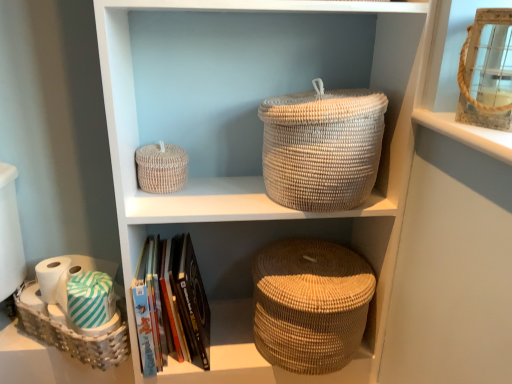
Question: Considering the positions of green striped fabric at lower left, which appears as the 1th toilet paper when viewed from the right, and natural woven basket at center in the image, is green striped fabric at lower left, which appears as the 1th toilet paper when viewed from the right, bigger or smaller than natural woven basket at center?

Choices:
 (A) big
 (B) small

Answer: (B)

Question: Relative to natural woven basket at center, is green striped fabric at lower left, which appears as the second toilet paper when viewed from the left, in front or behind?

Choices:
 (A) behind
 (B) front

Answer: (A)

Question: Which of these objects is positioned farthest from the brown woven basket at lower center?

Choices:
 (A) woven beige basket at upper left, acting as the 2th basket starting from the right
 (B) natural woven basket at center
 (C) white matte toilet paper at lower left, which ranks as the 1th toilet paper in left-to-right order
 (D) green striped fabric at lower left, which appears as the second toilet paper when viewed from the left
 (E) white woven basket at upper center, which appears as the third basket when ordered from the bottom

Answer: (C)

Question: Which is farther from the white woven basket at lower left, placed as the 3th basket when sorted from right to left?

Choices:
 (A) woven beige basket at upper left, the 2th basket positioned from the left
 (B) natural woven basket at center
 (C) white matte toilet paper at lower left, which ranks as the 1th toilet paper in left-to-right order
 (D) brown woven basket at lower center
 (E) white woven basket at upper center, placed as the first basket when sorted from right to left

Answer: (E)